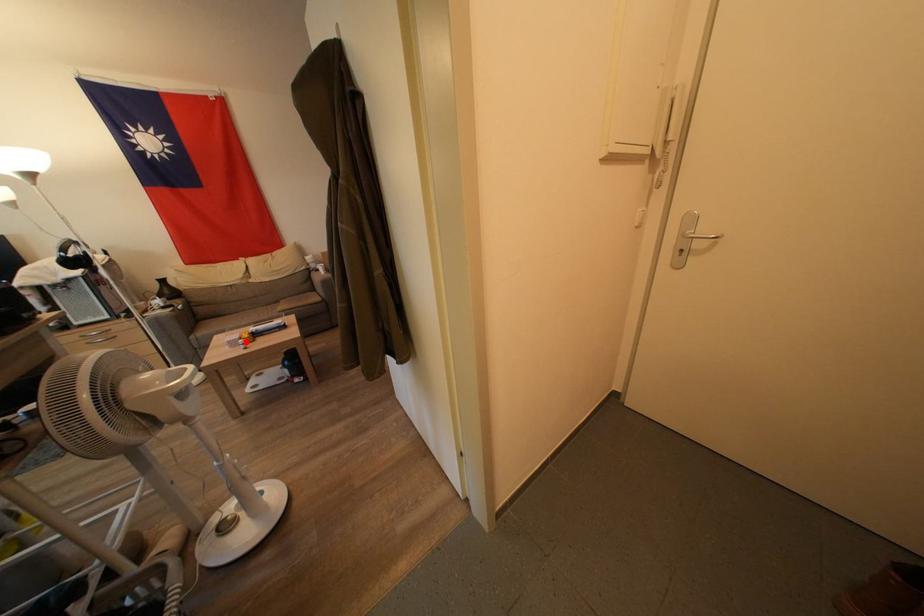
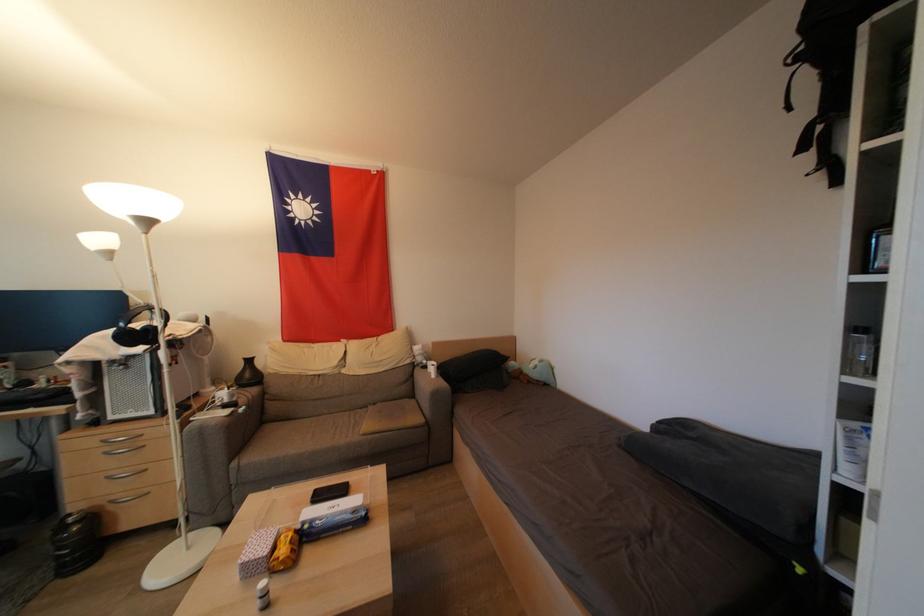
Find the pixel in the second image that matches the highlighted location in the first image.

(277, 553)